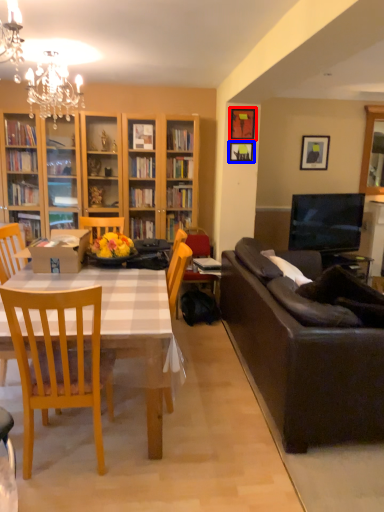
Question: Among these objects, which one is nearest to the camera, picture frame (highlighted by a red box) or picture frame (highlighted by a blue box)?

Choices:
 (A) picture frame
 (B) picture frame

Answer: (A)